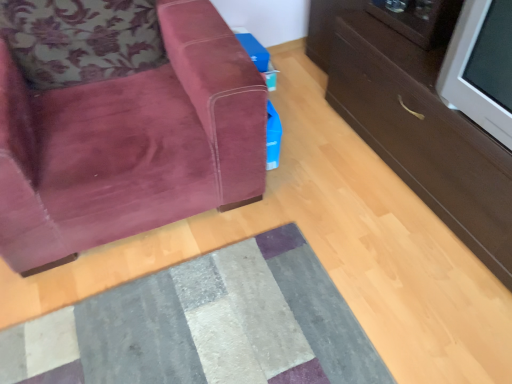
What is the approximate height of velvet maroon armchair at left?

29.58 inches.

What do you see at coordinates (120, 122) in the screenshot? I see `velvet maroon armchair at left` at bounding box center [120, 122].

Locate an element on the screen. The image size is (512, 384). velvet maroon armchair at left is located at coordinates (120, 122).

In the scene shown: What is the approximate width of textured gray rug at center?

textured gray rug at center is 27.75 inches in width.

You are a GUI agent. You are given a task and a screenshot of the screen. Output one action in this format:
    pyautogui.click(x=<x>, y=<y>)
    Task: Click on the textured gray rug at center
    The height and width of the screenshot is (384, 512).
    Given the screenshot: What is the action you would take?
    pyautogui.click(x=205, y=325)

Describe the element at coordinates (205, 325) in the screenshot. Image resolution: width=512 pixels, height=384 pixels. I see `textured gray rug at center` at that location.

This screenshot has height=384, width=512. Find the location of `velvet maroon armchair at left`. velvet maroon armchair at left is located at coordinates (120, 122).

From the picture: Considering the relative positions of textured gray rug at center and velvet maroon armchair at left in the image provided, is textured gray rug at center to the right of velvet maroon armchair at left from the viewer's perspective?

Yes, textured gray rug at center is to the right of velvet maroon armchair at left.

In the image, is textured gray rug at center positioned in front of or behind velvet maroon armchair at left?

Clearly, textured gray rug at center is behind velvet maroon armchair at left.

Which is closer, (270, 349) or (29, 190)?

Point (270, 349) is farther from the camera than point (29, 190).

From the image's perspective, which one is positioned lower, textured gray rug at center or velvet maroon armchair at left?

textured gray rug at center appears lower in the image.

From a real-world perspective, is textured gray rug at center on top of velvet maroon armchair at left?

Incorrect, from a real-world perspective, textured gray rug at center is lower than velvet maroon armchair at left.

Can you confirm if textured gray rug at center is wider than velvet maroon armchair at left?

In fact, textured gray rug at center might be narrower than velvet maroon armchair at left.

Considering the sizes of objects textured gray rug at center and velvet maroon armchair at left in the image provided, who is taller, textured gray rug at center or velvet maroon armchair at left?

With more height is velvet maroon armchair at left.

Considering the sizes of textured gray rug at center and velvet maroon armchair at left in the image, is textured gray rug at center bigger or smaller than velvet maroon armchair at left?

In the image, textured gray rug at center appears to be smaller than velvet maroon armchair at left.

Is textured gray rug at center spatially inside velvet maroon armchair at left, or outside of it?

textured gray rug at center is outside velvet maroon armchair at left.

Looking at this image, is textured gray rug at center far away from velvet maroon armchair at left?

No, textured gray rug at center is not far from velvet maroon armchair at left.

Is textured gray rug at center positioned with its back to velvet maroon armchair at left?

No, textured gray rug at center is not facing away from velvet maroon armchair at left.

I want to click on mat to the right of velvet maroon armchair at left, so click(205, 325).

Does velvet maroon armchair at left appear on the left side of textured gray rug at center?

Yes, velvet maroon armchair at left is to the left of textured gray rug at center.

Is the depth of velvet maroon armchair at left greater than that of textured gray rug at center?

No, it is not.

Which is further, (x=54, y=127) or (x=350, y=320)?

The point (x=54, y=127) is farther from the camera.

From the image's perspective, relative to textured gray rug at center, is velvet maroon armchair at left above or below?

velvet maroon armchair at left is situated higher than textured gray rug at center in the image.

From a real-world perspective, which is physically above, velvet maroon armchair at left or textured gray rug at center?

velvet maroon armchair at left, from a real-world perspective.

Can you confirm if velvet maroon armchair at left is thinner than textured gray rug at center?

Incorrect, the width of velvet maroon armchair at left is not less than that of textured gray rug at center.

Who is shorter, velvet maroon armchair at left or textured gray rug at center?

textured gray rug at center is shorter.

In the scene shown: Considering the relative sizes of velvet maroon armchair at left and textured gray rug at center in the image provided, is velvet maroon armchair at left bigger than textured gray rug at center?

Yes.

Would you say velvet maroon armchair at left contains textured gray rug at center?

Definitely not — textured gray rug at center is not inside velvet maroon armchair at left.

Is velvet maroon armchair at left far from textured gray rug at center?

No, velvet maroon armchair at left is not far from textured gray rug at center.

Based on the photo, is velvet maroon armchair at left oriented away from textured gray rug at center?

That's not correct — velvet maroon armchair at left is not looking away from textured gray rug at center.

You are a GUI agent. You are given a task and a screenshot of the screen. Output one action in this format:
    pyautogui.click(x=<x>, y=<y>)
    Task: Click on the mat behind the velvet maroon armchair at left
    The height and width of the screenshot is (384, 512).
    Given the screenshot: What is the action you would take?
    pyautogui.click(x=205, y=325)

Locate an element on the screen. This screenshot has width=512, height=384. chair on the left of textured gray rug at center is located at coordinates (120, 122).

The image size is (512, 384). Find the location of `mat below the velvet maroon armchair at left (from the image's perspective)`. mat below the velvet maroon armchair at left (from the image's perspective) is located at coordinates (205, 325).